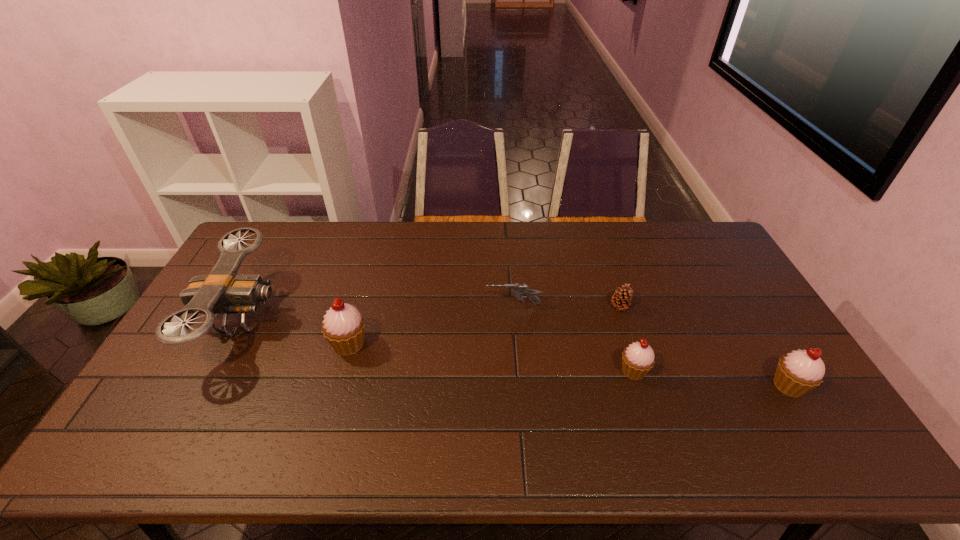
If equal spacing is the goal by inserting an additional cupcake among them, please point out a vacant space for this new cupcake. Please provide its 2D coordinates. Your answer should be formatted as a tuple, i.e. [(x, y)], where the tuple contains the x and y coordinates of a point satisfying the conditions above.

[(488, 357)]